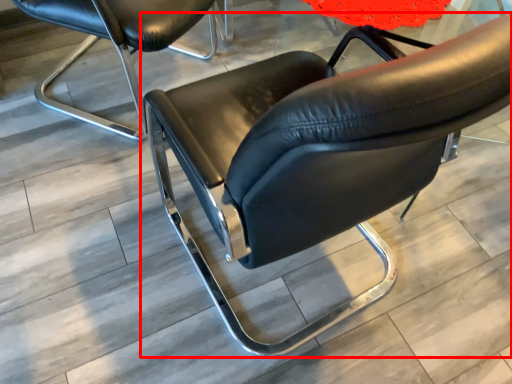
Question: From the image's perspective, where is chair (annotated by the red box) located in relation to chair in the image?

Choices:
 (A) above
 (B) below

Answer: (B)